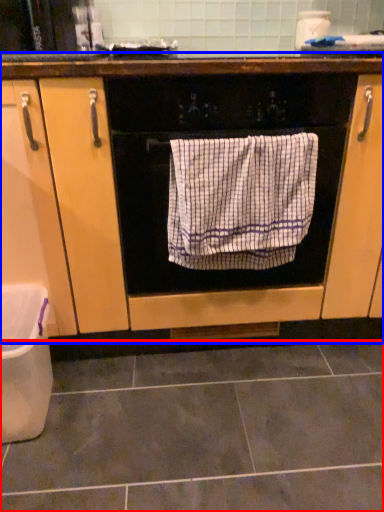
Question: Which object appears farthest to the camera in this image, ceramic tile (highlighted by a red box) or cabinetry (highlighted by a blue box)?

Choices:
 (A) ceramic tile
 (B) cabinetry

Answer: (B)